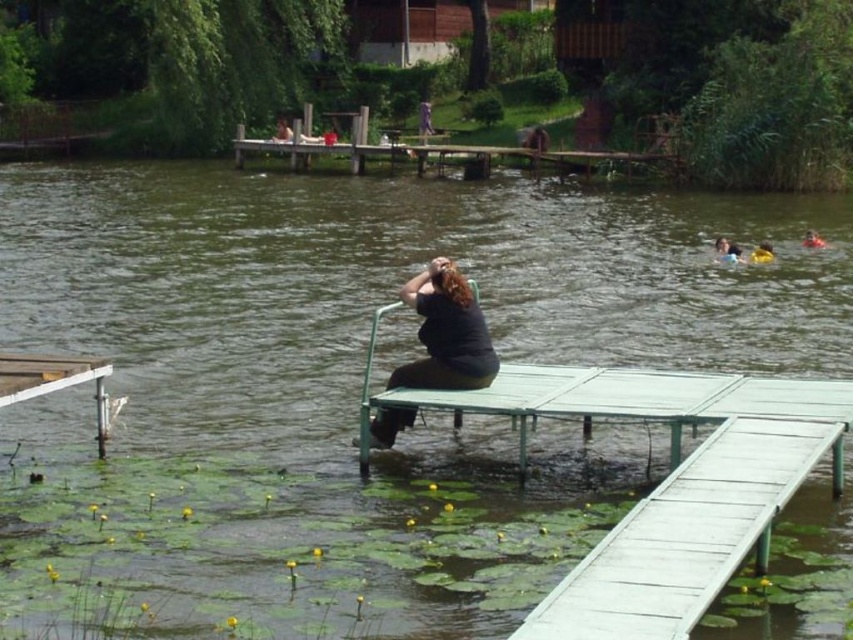
You are planning to place a new bench in the lakeside scene. The current bench is the black matte bench at center. You want to ensure that the new bench won not block the view of the yellow fabric person at upper right. Based on the scene description, can you confirm if the current bench is already positioned in a way that it does not block their view?

The black matte bench at center is positioned under the yellow fabric person at upper right, which means it is directly below them. Since the bench is under the person, it would likely block their view unless they are elevated. Therefore, the current bench placement might obstruct the view of the yellow fabric person at upper right.

You are planning to sit on the black matte bench at center and the orange life vest at upper right. Which one can you comfortably sit on?

The black matte bench at center has a larger size compared to orange life vest at upper right, so you can comfortably sit on the black matte bench at center.

You are a photographer standing on the wooden dock and want to place a black matte bench at center so that it is exactly 50 feet away from the yellow fabric person at upper right. Based on the current arrangement, is the bench positioned correctly?

The black matte bench at center and yellow fabric person at upper right are currently 52.87 feet apart, which is 2.87 feet more than the desired 50 feet. Therefore, the bench is not positioned correctly and needs to be moved closer by approximately 2.87 feet to meet the requirement.